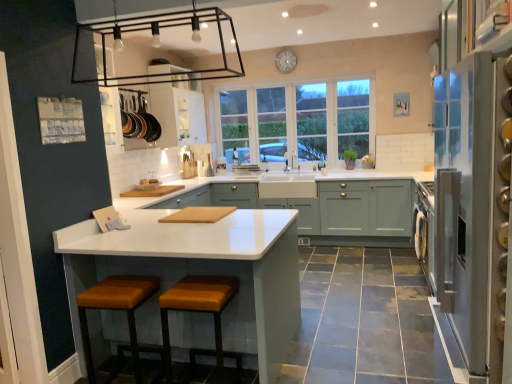
Identify the location of blank space above leather-like brown stool at lower center, arranged as the 2th step stool when viewed from the right (from a real-world perspective). This screenshot has width=512, height=384. (126, 289).